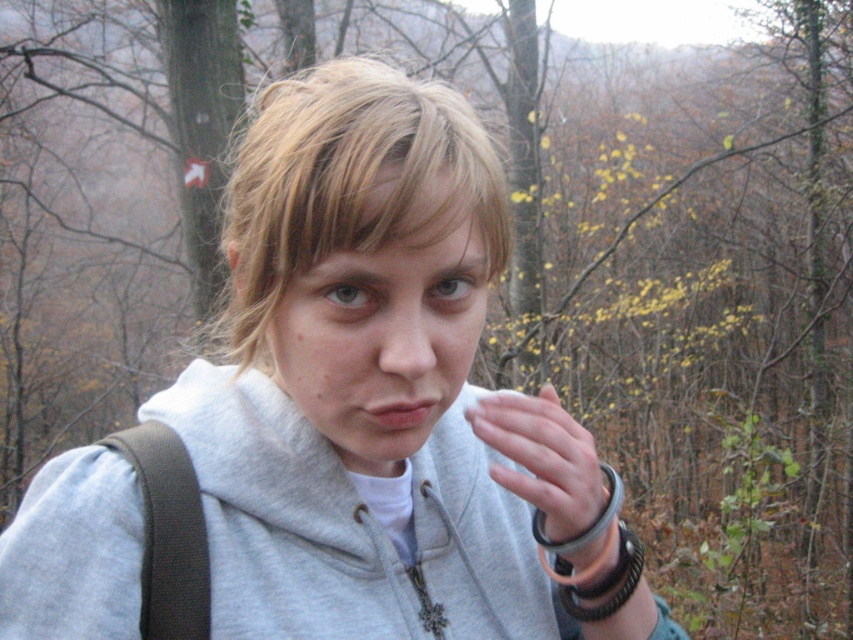
You are a hiker who wants to pack your belongings into a backpack. You have a gray hoodie at center and a white matte cloth at center. Which item can you fit into the backpack first without folding?

The white matte cloth at center can be fit into the backpack first without folding since it is smaller than the gray hoodie at center.

You are a photographer trying to capture a closeup of the blondehair at center and the white matte cloth at center in the scene. Which object should you zoom in on to ensure both are in focus without adjusting the camera settings?

The white matte cloth at center is smaller than the blondehair at center, so you should zoom in on the blondehair at center to ensure both are in focus.

You are a photographer trying to capture a hiker in a forest. You notice the gray sweatshirt at center and the gray hoodie at center. Which clothing item is located to the left of the other?

The gray sweatshirt at center is positioned on the left side of gray hoodie at center.